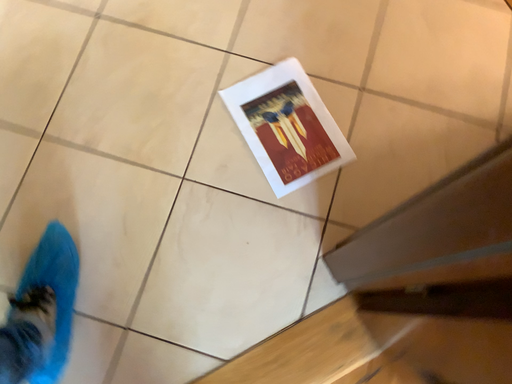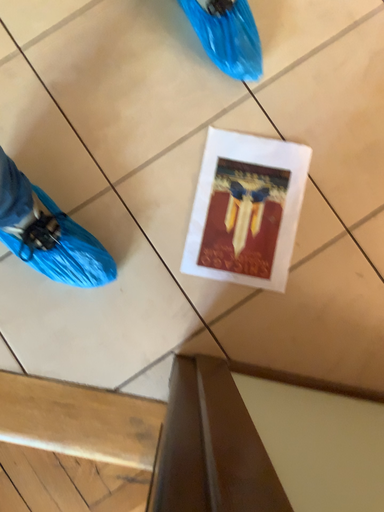
Question: Which way did the camera rotate in the video?

Choices:
 (A) rotated left
 (B) rotated right

Answer: (A)